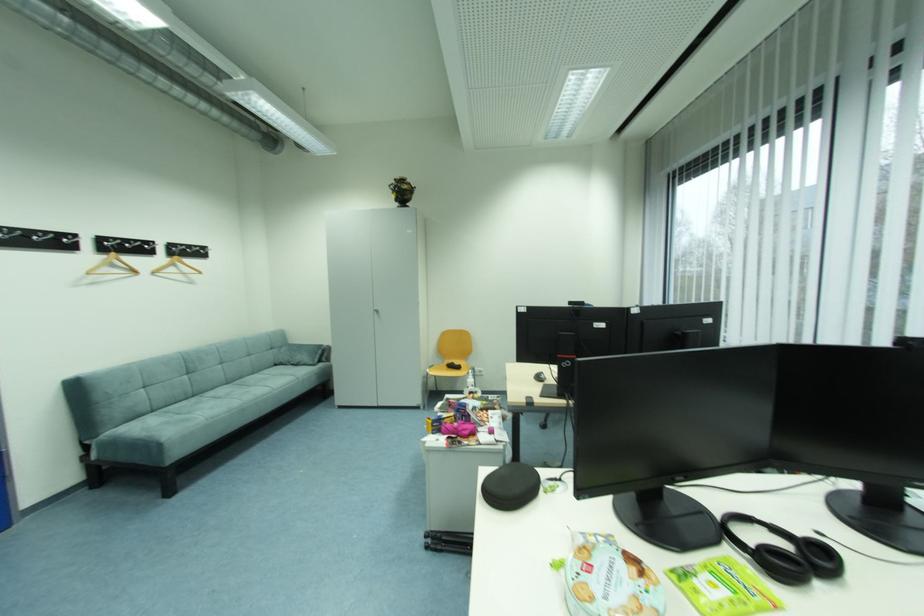
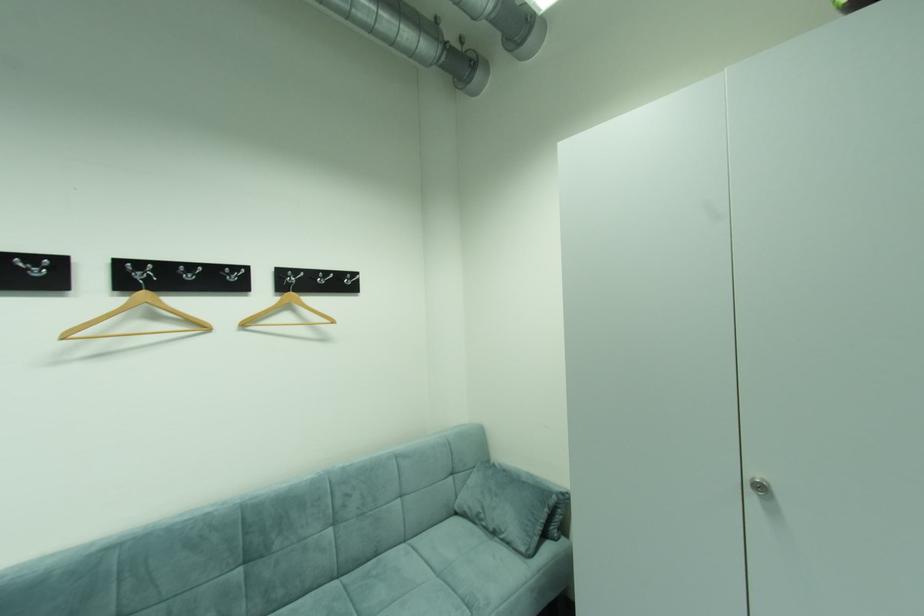
Where in the second image is the point corresponding to point (249, 379) from the first image?

(383, 554)